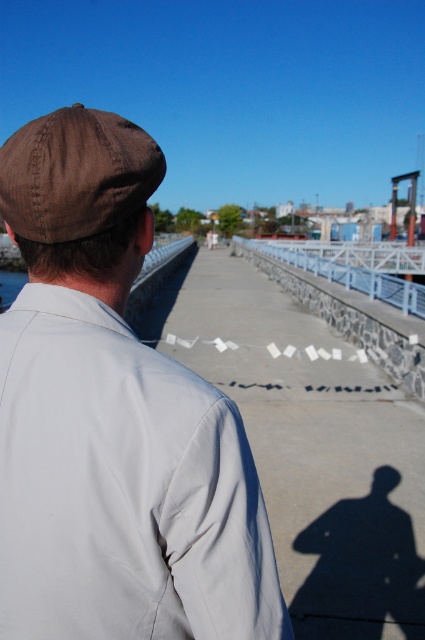
You are a photographer positioned at the starting point of the pier. You notice the brown fabric cap at upper left in the scene. Can you determine its exact coordinates to frame it properly in your shot?

The brown fabric cap at upper left is located at point (113, 419), so you can frame it by focusing on those coordinates.

You are a photographer trying to capture the brown fabric baseball cap at upper left and the white metal rail at center in the same frame. Based on their heights, which object will appear smaller in the photo?

The brown fabric baseball cap at upper left appears smaller in the photo because it has a lesser height compared to the white metal rail at center.